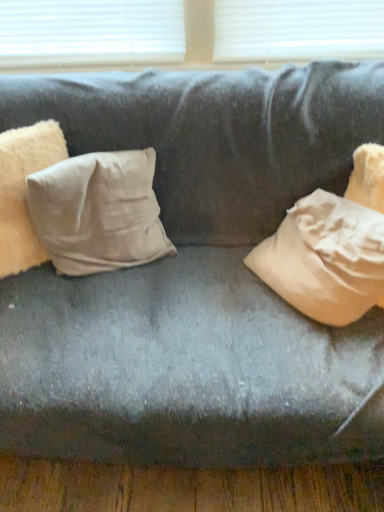
Locate an element on the screen. This screenshot has width=384, height=512. beige cotton pillow at left, placed as the second pillow when sorted from right to left is located at coordinates (24, 191).

Describe the element at coordinates (24, 191) in the screenshot. I see `beige cotton pillow at left, marked as the first pillow in a left-to-right arrangement` at that location.

This screenshot has width=384, height=512. What do you see at coordinates (98, 212) in the screenshot?
I see `beige cotton pillow at center-left, which is the 2th pillow in left-to-right order` at bounding box center [98, 212].

Where is `beige cotton pillow at center-left, which is counted as the 1th pillow, starting from the right`? beige cotton pillow at center-left, which is counted as the 1th pillow, starting from the right is located at coordinates (98, 212).

You are a GUI agent. You are given a task and a screenshot of the screen. Output one action in this format:
    pyautogui.click(x=<x>, y=<y>)
    Task: Click on the beige cotton pillow at left, placed as the second pillow when sorted from right to left
    This screenshot has width=384, height=512.
    Given the screenshot: What is the action you would take?
    pyautogui.click(x=24, y=191)

Is beige cotton pillow at left, placed as the second pillow when sorted from right to left, at the left side of beige cotton pillow at center-left, which is the 2th pillow in left-to-right order?

Correct, you'll find beige cotton pillow at left, placed as the second pillow when sorted from right to left, to the left of beige cotton pillow at center-left, which is the 2th pillow in left-to-right order.

From the picture: Does beige cotton pillow at left, placed as the second pillow when sorted from right to left, lie in front of beige cotton pillow at center-left, which is counted as the 1th pillow, starting from the right?

Yes, it is in front of beige cotton pillow at center-left, which is counted as the 1th pillow, starting from the right.

Considering the positions of points (10, 243) and (93, 216), is point (10, 243) closer to camera compared to point (93, 216)?

Yes, it is.

From the image's perspective, which one is positioned lower, beige cotton pillow at left, placed as the second pillow when sorted from right to left, or beige cotton pillow at center-left, which is the 2th pillow in left-to-right order?

beige cotton pillow at center-left, which is the 2th pillow in left-to-right order.

From a real-world perspective, is beige cotton pillow at left, placed as the second pillow when sorted from right to left, positioned above or below beige cotton pillow at center-left, which is counted as the 1th pillow, starting from the right?

In terms of real-world spatial position, beige cotton pillow at left, placed as the second pillow when sorted from right to left, is above beige cotton pillow at center-left, which is counted as the 1th pillow, starting from the right.

Which object is thinner, beige cotton pillow at left, marked as the first pillow in a left-to-right arrangement, or beige cotton pillow at center-left, which is counted as the 1th pillow, starting from the right?

Thinner between the two is beige cotton pillow at left, marked as the first pillow in a left-to-right arrangement.

Who is shorter, beige cotton pillow at left, placed as the second pillow when sorted from right to left, or beige cotton pillow at center-left, which is the 2th pillow in left-to-right order?

Standing shorter between the two is beige cotton pillow at center-left, which is the 2th pillow in left-to-right order.

Is beige cotton pillow at left, marked as the first pillow in a left-to-right arrangement, smaller than beige cotton pillow at center-left, which is the 2th pillow in left-to-right order?

Indeed, beige cotton pillow at left, marked as the first pillow in a left-to-right arrangement, has a smaller size compared to beige cotton pillow at center-left, which is the 2th pillow in left-to-right order.

Is beige cotton pillow at center-left, which is counted as the 1th pillow, starting from the right, completely or partially inside beige cotton pillow at left, placed as the second pillow when sorted from right to left?

Definitely not — beige cotton pillow at center-left, which is counted as the 1th pillow, starting from the right, is not inside beige cotton pillow at left, placed as the second pillow when sorted from right to left.

Looking at this image, is beige cotton pillow at left, marked as the first pillow in a left-to-right arrangement, touching beige cotton pillow at center-left, which is the 2th pillow in left-to-right order?

No, beige cotton pillow at left, marked as the first pillow in a left-to-right arrangement, is not making contact with beige cotton pillow at center-left, which is the 2th pillow in left-to-right order.

Is beige cotton pillow at left, placed as the second pillow when sorted from right to left, oriented away from beige cotton pillow at center-left, which is the 2th pillow in left-to-right order?

beige cotton pillow at left, placed as the second pillow when sorted from right to left, does not have its back to beige cotton pillow at center-left, which is the 2th pillow in left-to-right order.

How distant is beige cotton pillow at left, marked as the first pillow in a left-to-right arrangement, from beige cotton pillow at center-left, which is the 2th pillow in left-to-right order?

They are 5.60 inches apart.

In order to click on pillow to the right of beige cotton pillow at left, marked as the first pillow in a left-to-right arrangement in this screenshot , I will do `click(98, 212)`.

Between beige cotton pillow at center-left, which is the 2th pillow in left-to-right order, and beige cotton pillow at left, placed as the second pillow when sorted from right to left, which one appears on the left side from the viewer's perspective?

beige cotton pillow at left, placed as the second pillow when sorted from right to left.

Is beige cotton pillow at center-left, which is the 2th pillow in left-to-right order, behind beige cotton pillow at left, placed as the second pillow when sorted from right to left?

Yes, beige cotton pillow at center-left, which is the 2th pillow in left-to-right order, is further from the viewer.

Does point (54, 246) come in front of point (49, 122)?

No, (54, 246) is further to viewer.

From the image's perspective, which is below, beige cotton pillow at center-left, which is the 2th pillow in left-to-right order, or beige cotton pillow at left, placed as the second pillow when sorted from right to left?

beige cotton pillow at center-left, which is the 2th pillow in left-to-right order, appears lower in the image.

From a real-world perspective, between beige cotton pillow at center-left, which is the 2th pillow in left-to-right order, and beige cotton pillow at left, marked as the first pillow in a left-to-right arrangement, who is vertically lower?

beige cotton pillow at center-left, which is the 2th pillow in left-to-right order, from a real-world perspective.

Which of these two, beige cotton pillow at center-left, which is counted as the 1th pillow, starting from the right, or beige cotton pillow at left, placed as the second pillow when sorted from right to left, is wider?

Wider between the two is beige cotton pillow at center-left, which is counted as the 1th pillow, starting from the right.

In terms of height, does beige cotton pillow at center-left, which is counted as the 1th pillow, starting from the right, look taller or shorter compared to beige cotton pillow at left, placed as the second pillow when sorted from right to left?

beige cotton pillow at center-left, which is counted as the 1th pillow, starting from the right, is shorter than beige cotton pillow at left, placed as the second pillow when sorted from right to left.

Does beige cotton pillow at center-left, which is counted as the 1th pillow, starting from the right, have a smaller size compared to beige cotton pillow at left, placed as the second pillow when sorted from right to left?

No, beige cotton pillow at center-left, which is counted as the 1th pillow, starting from the right, is not smaller than beige cotton pillow at left, placed as the second pillow when sorted from right to left.

Is beige cotton pillow at center-left, which is the 2th pillow in left-to-right order, surrounding beige cotton pillow at left, placed as the second pillow when sorted from right to left?

No, beige cotton pillow at left, placed as the second pillow when sorted from right to left, is located outside of beige cotton pillow at center-left, which is the 2th pillow in left-to-right order.

Is there a large distance between beige cotton pillow at center-left, which is the 2th pillow in left-to-right order, and beige cotton pillow at left, placed as the second pillow when sorted from right to left?

No, there isn't a large distance between beige cotton pillow at center-left, which is the 2th pillow in left-to-right order, and beige cotton pillow at left, placed as the second pillow when sorted from right to left.

Is beige cotton pillow at center-left, which is the 2th pillow in left-to-right order, positioned with its back to beige cotton pillow at left, placed as the second pillow when sorted from right to left?

beige cotton pillow at center-left, which is the 2th pillow in left-to-right order, is not turned away from beige cotton pillow at left, placed as the second pillow when sorted from right to left.

How many degrees apart are the facing directions of beige cotton pillow at center-left, which is counted as the 1th pillow, starting from the right, and beige cotton pillow at left, marked as the first pillow in a left-to-right arrangement?

They differ by 21.2 degrees in their facing directions.

Could you measure the distance between beige cotton pillow at center-left, which is counted as the 1th pillow, starting from the right, and beige cotton pillow at left, marked as the first pillow in a left-to-right arrangement?

They are 14.22 centimeters apart.

Find the location of a particular element. The width and height of the screenshot is (384, 512). pillow below the beige cotton pillow at left, placed as the second pillow when sorted from right to left (from a real-world perspective) is located at coordinates (98, 212).

At what (x,y) coordinates should I click in order to perform the action: click on pillow that appears on the right of beige cotton pillow at left, placed as the second pillow when sorted from right to left. Please return your answer as a coordinate pair (x, y). Looking at the image, I should click on (98, 212).

This screenshot has height=512, width=384. In order to click on pillow that is above the beige cotton pillow at center-left, which is counted as the 1th pillow, starting from the right (from the image's perspective) in this screenshot , I will do `click(24, 191)`.